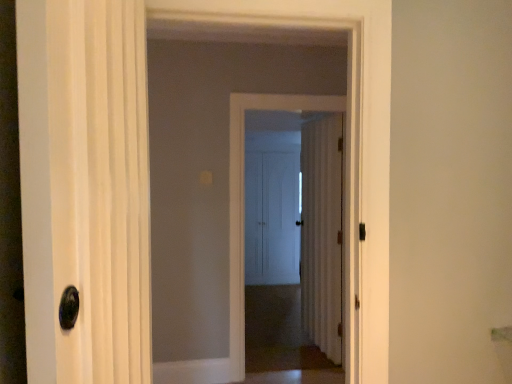
What is the approximate height of brown carpet at center?

It is 2.46 inches.

The width and height of the screenshot is (512, 384). Identify the location of brown carpet at center. (282, 340).

What is the approximate width of white glossy door at left, the fourth door in the back-to-front sequence?

18.84 centimeters.

Identify the location of white glossy door at left, the 1th door in the front-to-back sequence. (85, 188).

This screenshot has height=384, width=512. Describe the element at coordinates (243, 197) in the screenshot. I see `white matte door at center, the 3th door from the back` at that location.

You are a GUI agent. You are given a task and a screenshot of the screen. Output one action in this format:
    pyautogui.click(x=<x>, y=<y>)
    Task: Click on the brown carpet at center
    
    Given the screenshot: What is the action you would take?
    (x=282, y=340)

From the image's perspective, is brown carpet at center under white matte door at center, arranged as the 1th door when viewed from the back?

Yes.

Which object is thinner, brown carpet at center or white matte door at center, arranged as the 1th door when viewed from the back?

With smaller width is white matte door at center, arranged as the 1th door when viewed from the back.

Which object is positioned more to the right, brown carpet at center or white matte door at center, the fourth door from the front?

white matte door at center, the fourth door from the front, is more to the right.

Is brown carpet at center taller than white matte door at center, arranged as the 1th door when viewed from the back?

In fact, brown carpet at center may be shorter than white matte door at center, arranged as the 1th door when viewed from the back.

Can you confirm if brown carpet at center is wider than white glossy door at center?

Yes, brown carpet at center is wider than white glossy door at center.

Choose the correct answer: Is brown carpet at center inside white glossy door at center or outside it?

brown carpet at center exists outside the volume of white glossy door at center.

Are brown carpet at center and white glossy door at center located far from each other?

Yes.

Between brown carpet at center and white glossy door at center, which one has less height?

brown carpet at center.

In the scene shown: Considering the positions of objects brown carpet at center and white matte door at center, the 3th door from the back, in the image provided, who is more to the right, brown carpet at center or white matte door at center, the 3th door from the back,?

From the viewer's perspective, white matte door at center, the 3th door from the back, appears more on the right side.

From the image's perspective, between brown carpet at center and white matte door at center, which appears as the second door when viewed from the front, which one is located above?

white matte door at center, which appears as the second door when viewed from the front, appears higher in the image.

Is brown carpet at center beside white matte door at center, the 3th door from the back?

No, brown carpet at center is not beside white matte door at center, the 3th door from the back.

Considering their positions, is white glossy door at center located in front of or behind white wood door at center, acting as the 3th door starting from the front?

In the image, white glossy door at center appears in front of white wood door at center, acting as the 3th door starting from the front.

From the image's perspective, does white glossy door at center appear lower than white wood door at center, acting as the 3th door starting from the front?

No, from the image's perspective, white glossy door at center is not beneath white wood door at center, acting as the 3th door starting from the front.

Which is correct: white glossy door at center is inside white wood door at center, which is counted as the 2th door, starting from the back, or outside of it?

white glossy door at center is not inside white wood door at center, which is counted as the 2th door, starting from the back, it's outside.

Is white glossy door at center facing towards white wood door at center, which is counted as the 2th door, starting from the back?

No, white glossy door at center is not oriented towards white wood door at center, which is counted as the 2th door, starting from the back.

Is white glossy door at left, the 1th door in the front-to-back sequence, taller than white matte door at center, arranged as the 1th door when viewed from the back?

In fact, white glossy door at left, the 1th door in the front-to-back sequence, may be shorter than white matte door at center, arranged as the 1th door when viewed from the back.

From the image's perspective, does white glossy door at left, the fourth door in the back-to-front sequence, appear higher than white matte door at center, arranged as the 1th door when viewed from the back?

Yes, from the image's perspective, white glossy door at left, the fourth door in the back-to-front sequence, is on top of white matte door at center, arranged as the 1th door when viewed from the back.

Looking at this image, is white glossy door at left, the 1th door in the front-to-back sequence, in front of or behind white matte door at center, arranged as the 1th door when viewed from the back, in the image?

Clearly, white glossy door at left, the 1th door in the front-to-back sequence, is in front of white matte door at center, arranged as the 1th door when viewed from the back.

Based on the photo, from a real-world perspective, does white glossy door at center sit lower than brown carpet at center?

No, from a real-world perspective, white glossy door at center is not below brown carpet at center.

Between white glossy door at center and brown carpet at center, which one has larger width?

brown carpet at center is wider.

Is point (155, 374) positioned before point (246, 310)?

Yes, point (155, 374) is in front of point (246, 310).

Which object is positioned more to the left, white glossy door at center or brown carpet at center?

Positioned to the left is white glossy door at center.

Is white matte door at center, the fourth door from the front, facing towards white glossy door at left, the fourth door in the back-to-front sequence?

No, white matte door at center, the fourth door from the front, does not turn towards white glossy door at left, the fourth door in the back-to-front sequence.

From the picture: Would you say white glossy door at left, the fourth door in the back-to-front sequence, is part of white matte door at center, the fourth door from the front,'s contents?

No, white glossy door at left, the fourth door in the back-to-front sequence, is not inside white matte door at center, the fourth door from the front.

Are white matte door at center, the fourth door from the front, and white glossy door at left, the 1th door in the front-to-back sequence, far apart?

white matte door at center, the fourth door from the front, is far away from white glossy door at left, the 1th door in the front-to-back sequence.

From the image's perspective, count 1st doors upward from the brown carpet at center and point to it. Please provide its 2D coordinates.

[(272, 208)]

I want to click on path below the white glossy door at center (from the image's perspective), so click(282, 340).

When comparing their distances from white glossy door at left, the 1th door in the front-to-back sequence, does white matte door at center, the fourth door from the front, or white wood door at center, acting as the 3th door starting from the front, seem further?

Among the two, white matte door at center, the fourth door from the front, is located further to white glossy door at left, the 1th door in the front-to-back sequence.

Based on their spatial positions, is brown carpet at center or white glossy door at left, the 1th door in the front-to-back sequence, further from white glossy door at center?

Among the two, white glossy door at left, the 1th door in the front-to-back sequence, is located further to white glossy door at center.

When comparing their distances from brown carpet at center, does white glossy door at center or white wood door at center, acting as the 3th door starting from the front, seem closer?

white wood door at center, acting as the 3th door starting from the front, lies closer to brown carpet at center than the other object.

Considering their positions, is white glossy door at center positioned further to white wood door at center, which is counted as the 2th door, starting from the back, than white matte door at center, arranged as the 1th door when viewed from the back?

Among the two, white matte door at center, arranged as the 1th door when viewed from the back, is located further to white wood door at center, which is counted as the 2th door, starting from the back.

Estimate the real-world distances between objects in this image. Which object is closer to white matte door at center, the 3th door from the back, white glossy door at left, the 1th door in the front-to-back sequence, or white matte door at center, arranged as the 1th door when viewed from the back?

The object closer to white matte door at center, the 3th door from the back, is white glossy door at left, the 1th door in the front-to-back sequence.

Based on their spatial positions, is white glossy door at center or white wood door at center, which is counted as the 2th door, starting from the back, further from white matte door at center, which appears as the second door when viewed from the front?

white wood door at center, which is counted as the 2th door, starting from the back, lies further to white matte door at center, which appears as the second door when viewed from the front, than the other object.

Considering their positions, is white glossy door at left, the 1th door in the front-to-back sequence, positioned closer to white matte door at center, arranged as the 1th door when viewed from the back, than white wood door at center, which is counted as the 2th door, starting from the back?

white wood door at center, which is counted as the 2th door, starting from the back, is positioned closer to the anchor white matte door at center, arranged as the 1th door when viewed from the back.

Looking at the image, which one is located closer to white glossy door at center, white matte door at center, the fourth door from the front, or brown carpet at center?

The object closer to white glossy door at center is brown carpet at center.

Identify the location of door between white glossy door at center and white wood door at center, acting as the 3th door starting from the front, in the front-back direction. (243, 197).

Where is `elevator between white glossy door at left, the fourth door in the back-to-front sequence, and brown carpet at center from front to back`? elevator between white glossy door at left, the fourth door in the back-to-front sequence, and brown carpet at center from front to back is located at coordinates (347, 111).

Where is `door positioned between white matte door at center, the 3th door from the back, and white matte door at center, arranged as the 1th door when viewed from the back, from near to far`? door positioned between white matte door at center, the 3th door from the back, and white matte door at center, arranged as the 1th door when viewed from the back, from near to far is located at coordinates (322, 233).

Identify the location of door between white glossy door at left, the fourth door in the back-to-front sequence, and white wood door at center, which is counted as the 2th door, starting from the back, along the z-axis. (243, 197).